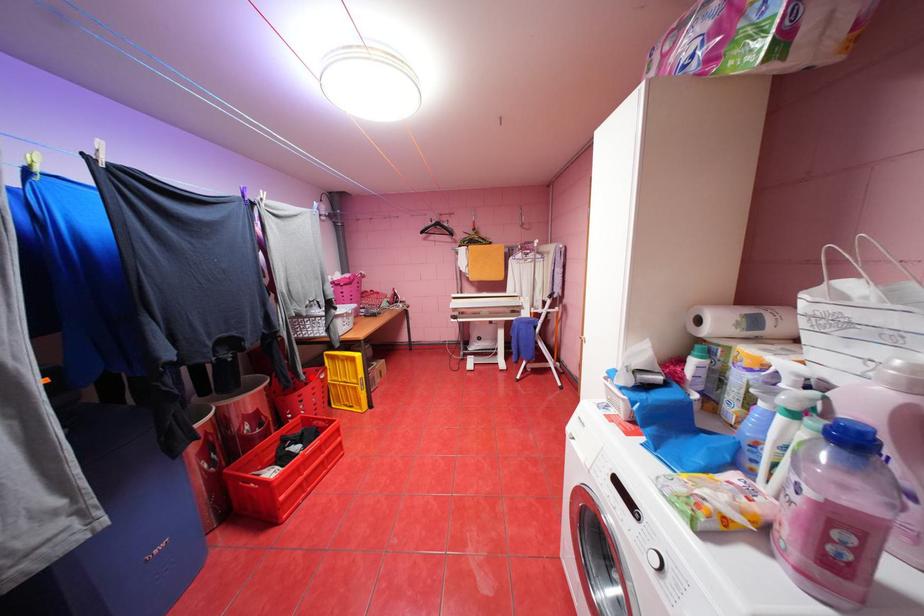
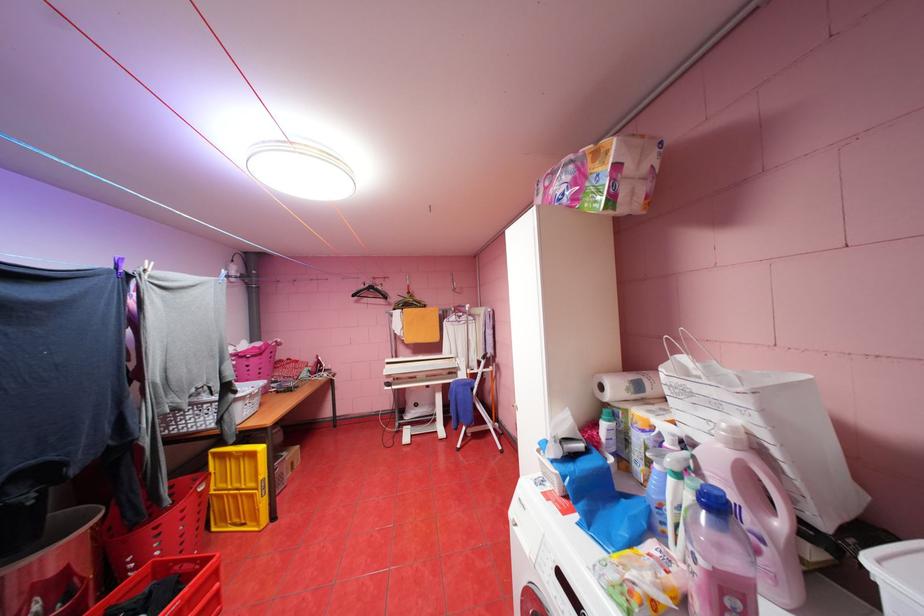
Locate, in the second image, the point that corresponds to the highlighted location in the first image.

(176, 501)